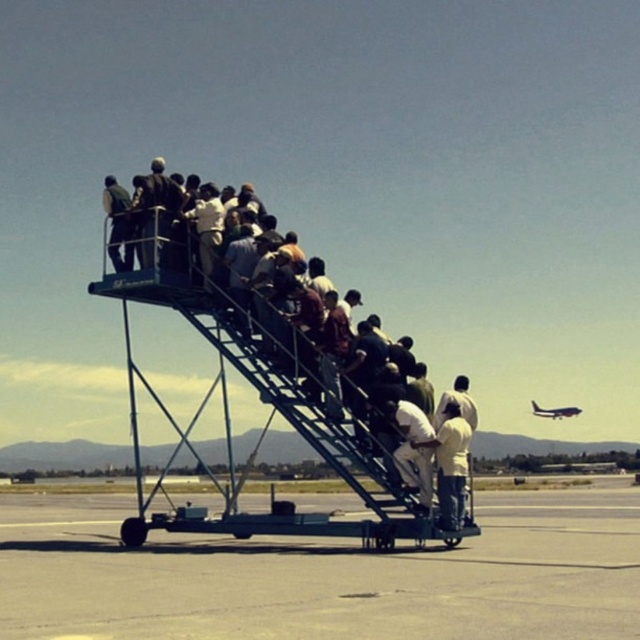
Question: Which object is the farthest from the dark blue metal staircase at center?

Choices:
 (A) metallic silver airplane at upper right
 (B) smooth concrete tarmac at lower left

Answer: (A)

Question: Can you confirm if smooth concrete tarmac at lower left is positioned to the right of dark blue metal staircase at center?

Choices:
 (A) no
 (B) yes

Answer: (B)

Question: Where is dark blue metal staircase at center located in relation to metallic silver airplane at upper right in the image?

Choices:
 (A) right
 (B) left

Answer: (B)

Question: Which of the following is the closest to the observer?

Choices:
 (A) (593, 493)
 (B) (186, 506)

Answer: (B)

Question: Can you confirm if dark blue metal staircase at center is bigger than metallic silver airplane at upper right?

Choices:
 (A) yes
 (B) no

Answer: (A)

Question: Considering the real-world distances, which object is closest to the metallic silver airplane at upper right?

Choices:
 (A) dark blue metal staircase at center
 (B) smooth concrete tarmac at lower left

Answer: (A)